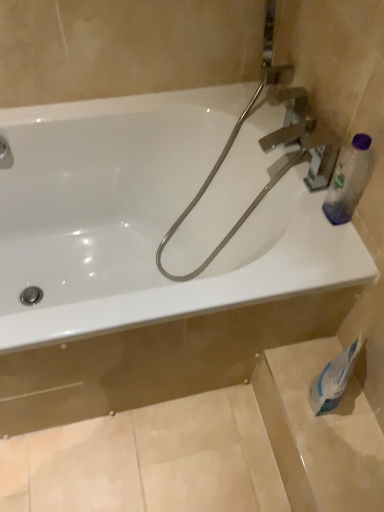
Question: From the image's perspective, would you say white glossy bathtub at upper center is positioned over transparent plastic bottle at upper right?

Choices:
 (A) yes
 (B) no

Answer: (B)

Question: Can you confirm if white glossy bathtub at upper center is thinner than transparent plastic bottle at upper right?

Choices:
 (A) yes
 (B) no

Answer: (B)

Question: Does white glossy bathtub at upper center turn towards transparent plastic bottle at upper right?

Choices:
 (A) yes
 (B) no

Answer: (B)

Question: Considering the relative sizes of white glossy bathtub at upper center and transparent plastic bottle at upper right in the image provided, is white glossy bathtub at upper center bigger than transparent plastic bottle at upper right?

Choices:
 (A) yes
 (B) no

Answer: (A)

Question: From a real-world perspective, is white glossy bathtub at upper center on top of transparent plastic bottle at upper right?

Choices:
 (A) no
 (B) yes

Answer: (A)

Question: Is point (48, 168) closer or farther from the camera than point (11, 157)?

Choices:
 (A) farther
 (B) closer

Answer: (A)

Question: Is white glossy bathtub at upper center taller or shorter than matte silver faucet at upper left?

Choices:
 (A) short
 (B) tall

Answer: (B)

Question: Looking at the image, does white glossy bathtub at upper center seem bigger or smaller compared to matte silver faucet at upper left?

Choices:
 (A) small
 (B) big

Answer: (B)

Question: In the image, is white glossy bathtub at upper center on the left side or the right side of matte silver faucet at upper left?

Choices:
 (A) left
 (B) right

Answer: (B)

Question: Is point (350, 360) positioned closer to the camera than point (329, 209)?

Choices:
 (A) farther
 (B) closer

Answer: (B)

Question: Relative to transparent plastic bottle at upper right, is white paper at lower right in front or behind?

Choices:
 (A) front
 (B) behind

Answer: (B)

Question: Is white paper at lower right bigger or smaller than transparent plastic bottle at upper right?

Choices:
 (A) small
 (B) big

Answer: (B)

Question: From the image's perspective, is white paper at lower right positioned above or below transparent plastic bottle at upper right?

Choices:
 (A) above
 (B) below

Answer: (B)

Question: Is matte silver faucet at upper left bigger or smaller than transparent plastic bottle at upper right?

Choices:
 (A) small
 (B) big

Answer: (A)

Question: In terms of height, does matte silver faucet at upper left look taller or shorter compared to transparent plastic bottle at upper right?

Choices:
 (A) short
 (B) tall

Answer: (A)